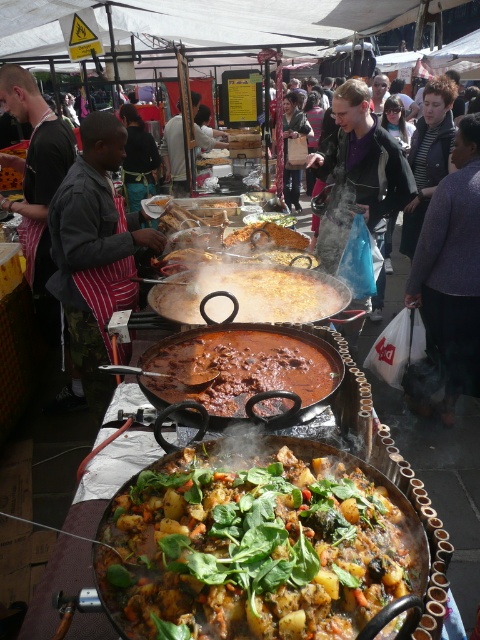
You are a food critic standing at the food market. You are wearing a striped apron at left. You want to reach the nearest pot to taste the dish. Which pot is closest to you?

The striped apron at left is 2.49 meters away from the viewer. Since the distance between the striped apron at left and the viewer is 2.49 meters, the closest pot would be the one nearest to the striped apron at left, but without specific information about the pots locations, it is impossible to determine which one is closest.

You are a customer at the food market and want to choose between the brown matte pan at center and the white fabric apron at center. Which one is larger?

The white fabric apron at center is larger than the brown matte pan at center.